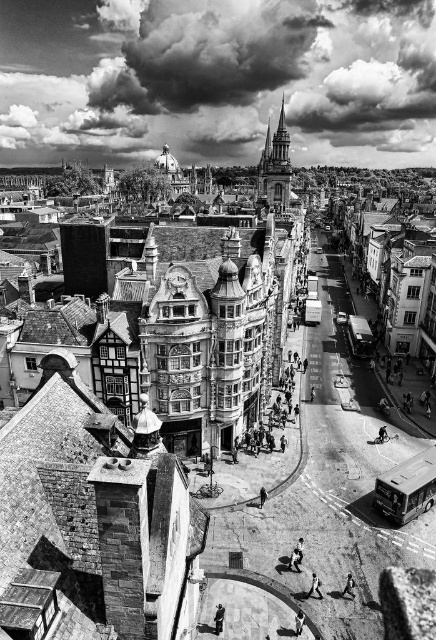
Who is taller, light gray fabric pants at lower center or smooth skin person at center?

Standing taller between the two is light gray fabric pants at lower center.

Is point (312, 579) farther from camera compared to point (353, 593)?

Yes.

Is point (319, 579) farther from camera compared to point (351, 579)?

Yes, it is behind point (351, 579).

This screenshot has height=640, width=436. I want to click on light gray fabric pants at lower center, so click(x=314, y=586).